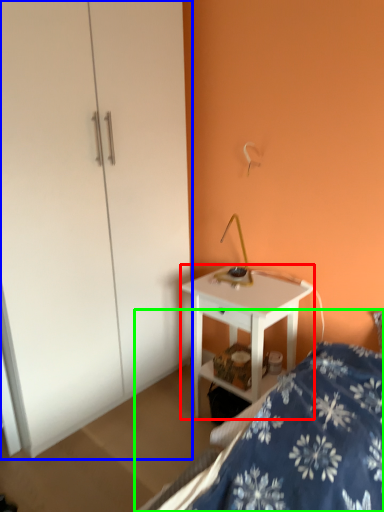
Question: Which object is positioned closest to desk (highlighted by a red box)? Select from dresser (highlighted by a blue box) and bed (highlighted by a green box).

Choices:
 (A) dresser
 (B) bed

Answer: (B)